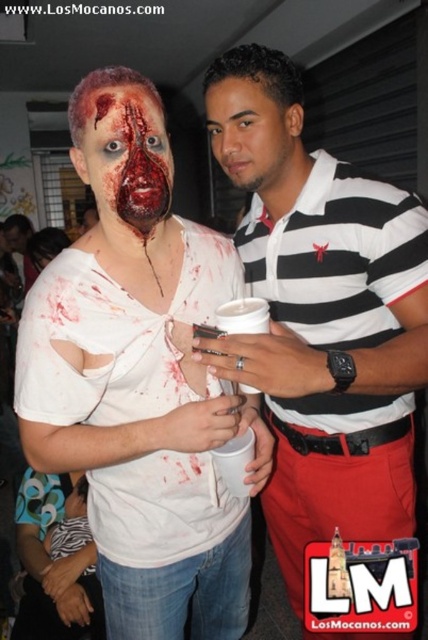
You are at a party and want to move from the zombie character to the person in the red pants. The zombie is at point (98, 176) and the person in red pants is at point (213, 132). Which direction should you move to get closer to the person in red pants?

To move closer to the person in red pants at point (213, 132) from the zombie at point (98, 176), you should move in the direction towards the upper left since point (213, 132) is located above and to the left of point (98, 176).